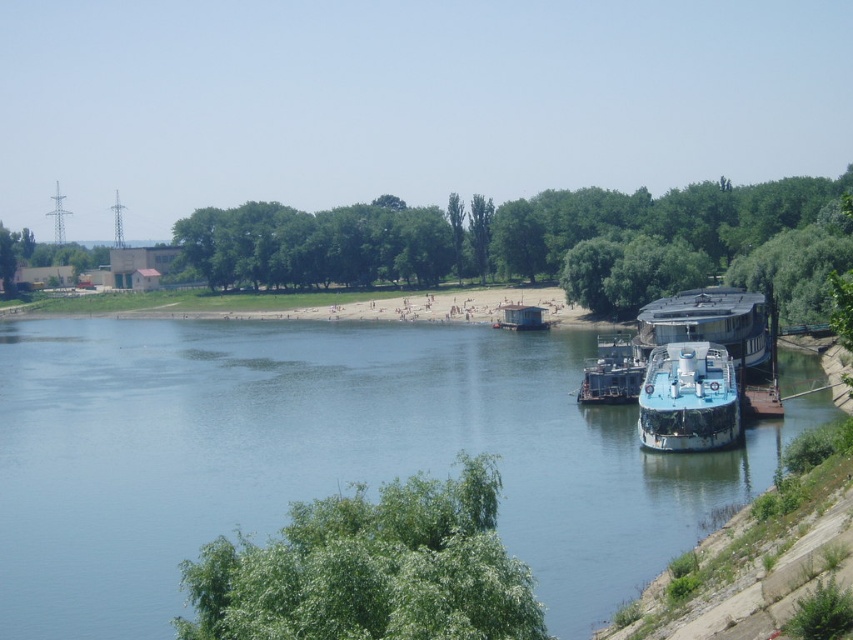
Which is below, blue metallic houseboat at right or rusty metal barge at lower right?

rusty metal barge at lower right is below.

Between point (695, 289) and point (577, 394), which one is positioned in front?

Point (577, 394)

Between point (717, 310) and point (643, 365), which one is positioned in front?

Point (643, 365) is more forward.

In order to click on blue metallic houseboat at right in this screenshot , I will do `click(706, 323)`.

Can you confirm if blue metallic boat at right is thinner than blue metallic houseboat at right?

Yes.

Between blue metallic boat at right and blue metallic houseboat at right, which one has less height?

blue metallic boat at right

Describe the element at coordinates (688, 397) in the screenshot. This screenshot has height=640, width=853. I see `blue metallic boat at right` at that location.

Identify the location of blue metallic boat at right. (688, 397).

Is point (706, 426) closer to viewer compared to point (611, 376)?

Yes, point (706, 426) is closer to viewer.

Between blue metallic boat at right and rusty metal barge at lower right, which one appears on the right side from the viewer's perspective?

rusty metal barge at lower right is more to the right.

What do you see at coordinates (688, 397) in the screenshot? I see `blue metallic boat at right` at bounding box center [688, 397].

At what (x,y) coordinates should I click in order to perform the action: click on blue metallic boat at right. Please return your answer as a coordinate pair (x, y). This screenshot has height=640, width=853. Looking at the image, I should click on (688, 397).